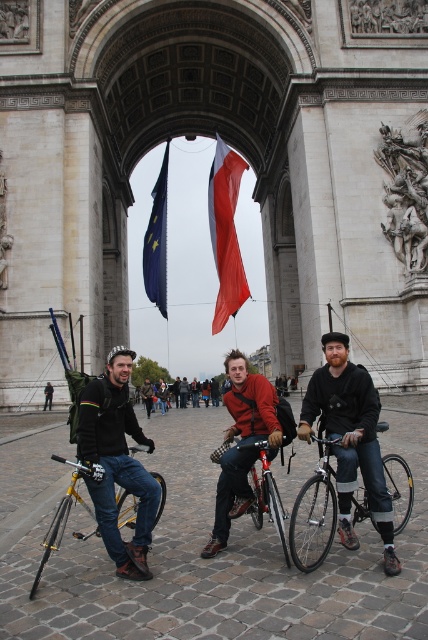
Question: Does matte black jacket at center lie in front of red fabric flag at center?

Choices:
 (A) no
 (B) yes

Answer: (B)

Question: Does red-orange sweater at center come behind shiny metallic bicycle at center?

Choices:
 (A) no
 (B) yes

Answer: (B)

Question: Which object is closer to the camera taking this photo?

Choices:
 (A) silver metallic bicycle at center
 (B) red-orange sweater at center
 (C) shiny metallic bicycle at center
 (D) blue fabric flag at center

Answer: (A)

Question: Considering the relative positions of silver metallic bicycle at center and shiny metallic bicycle at center in the image provided, where is silver metallic bicycle at center located with respect to shiny metallic bicycle at center?

Choices:
 (A) above
 (B) below

Answer: (A)

Question: Considering the real-world distances, which object is farthest from the silver metallic bicycle at center?

Choices:
 (A) red-orange sweater at center
 (B) yellow metallic bicycle at left

Answer: (B)

Question: Estimate the real-world distances between objects in this image. Which object is closer to the silver metallic bicycle at center?

Choices:
 (A) matte black jacket at center
 (B) shiny metallic bicycle at center
 (C) yellow metallic bicycle at left
 (D) blue fabric flag at center

Answer: (B)